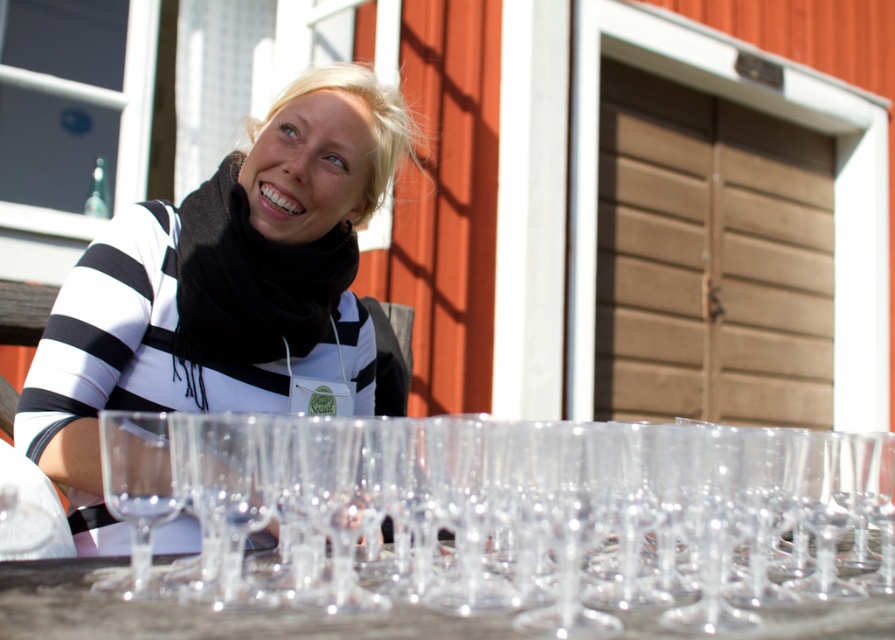
Question: Among these points, which one is farthest from the camera?

Choices:
 (A) (288, 636)
 (B) (179, 260)
 (C) (490, 608)

Answer: (B)

Question: Which of the following is the closest to the observer?

Choices:
 (A) (479, 557)
 (B) (158, 604)
 (C) (277, 136)

Answer: (B)

Question: Which of the following is the closest to the observer?

Choices:
 (A) black matte scarf at upper left
 (B) transparent glassware at lower center
 (C) transparent glass wine glass at center

Answer: (B)

Question: In this image, where is transparent glass wine glass at center located relative to transparent glassware at lower center?

Choices:
 (A) left
 (B) right

Answer: (B)

Question: Is transparent glass wine glass at center wider than black matte scarf at upper left?

Choices:
 (A) yes
 (B) no

Answer: (A)

Question: Is transparent glass wine glass at center bigger than black matte scarf at upper left?

Choices:
 (A) yes
 (B) no

Answer: (B)